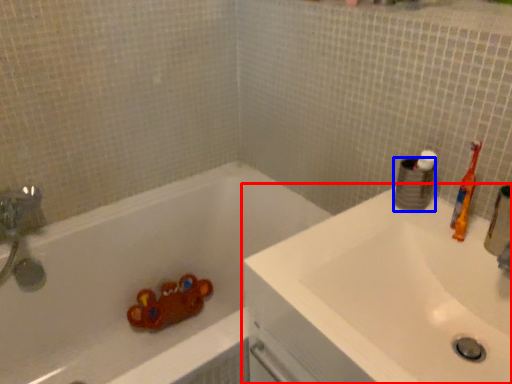
Question: Which object appears closest to the camera in this image, sink (highlighted by a red box) or toilet paper (highlighted by a blue box)?

Choices:
 (A) sink
 (B) toilet paper

Answer: (A)